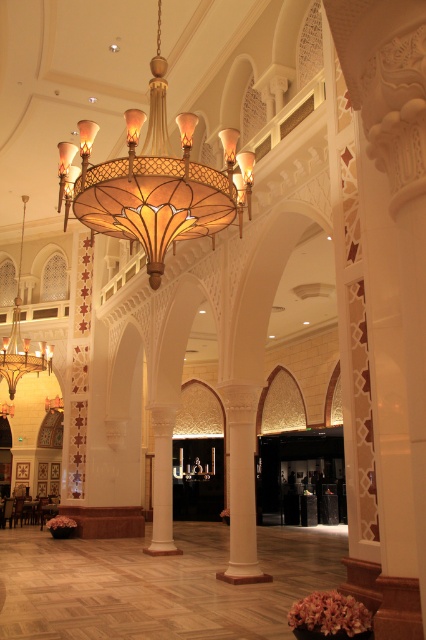
This screenshot has height=640, width=426. What do you see at coordinates (152, 180) in the screenshot?
I see `matte glass chandelier at center` at bounding box center [152, 180].

Identify the location of matte glass chandelier at center. Image resolution: width=426 pixels, height=640 pixels. (152, 180).